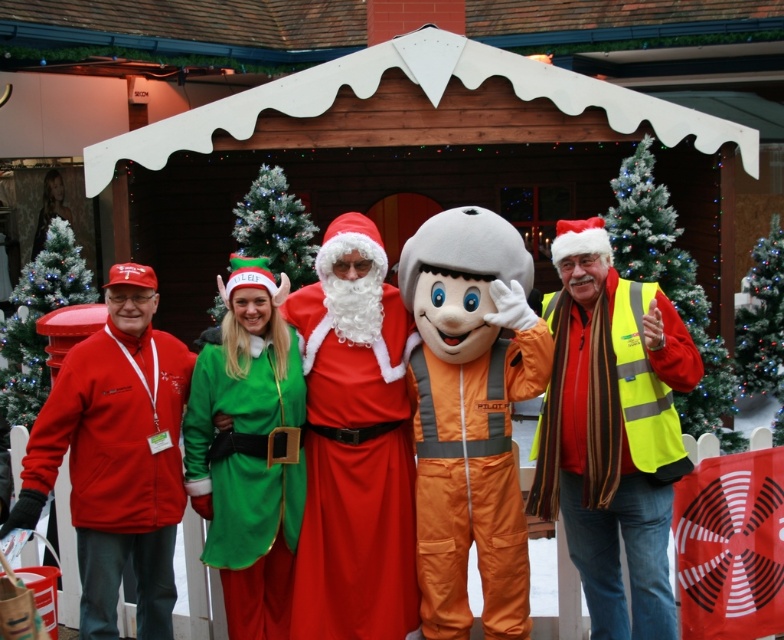
You are organizing a photo shoot and need to position the matte red santa at center and the red velvet santa suit at center so that they are both visible in the frame. Given their sizes, which one should be placed closer to the camera to ensure both are visible without one blocking the other?

The matte red santa at center is larger in size than the red velvet santa suit at center, so to ensure both are visible without one blocking the other, the smaller red velvet santa suit at center should be placed closer to the camera while the larger matte red santa at center can be positioned slightly further back.

Which object is located at the coordinates point (670, 288)?

The yellow reflective vest at right is located at point (670, 288).

You are a photographer trying to capture a group photo of the yellow reflective vest at right and the green matte christmas tree at center. Based on their positions, which object is closer to the left edge of the photo?

The yellow reflective vest at right is positioned on the left side of the green matte christmas tree at center, so it is closer to the left edge of the photo.